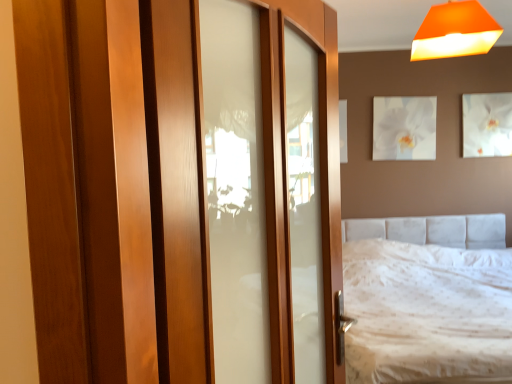
Question: From the image's perspective, is orange matte lampshade at upper right positioned above or below white glossy picture frame at upper center, the 1th picture frame when ordered from left to right?

Choices:
 (A) below
 (B) above

Answer: (B)

Question: Considering the positions of orange matte lampshade at upper right and white glossy picture frame at upper center, the 1th picture frame when ordered from left to right, in the image, is orange matte lampshade at upper right bigger or smaller than white glossy picture frame at upper center, the 1th picture frame when ordered from left to right,?

Choices:
 (A) small
 (B) big

Answer: (B)

Question: Which object is positioned farthest from the orange matte lampshade at upper right?

Choices:
 (A) white textured bed at center
 (B) wooden door at center
 (C) white glossy picture frame at upper center, the 1th picture frame when ordered from left to right
 (D) white glossy picture frame at upper right, marked as the first picture frame in a right-to-left arrangement

Answer: (D)

Question: Which is nearer to the white glossy picture frame at upper center, placed as the 2th picture frame when sorted from right to left?

Choices:
 (A) white textured bed at center
 (B) wooden door at center
 (C) orange matte lampshade at upper right
 (D) white glossy picture frame at upper right, acting as the 2th picture frame starting from the left

Answer: (D)